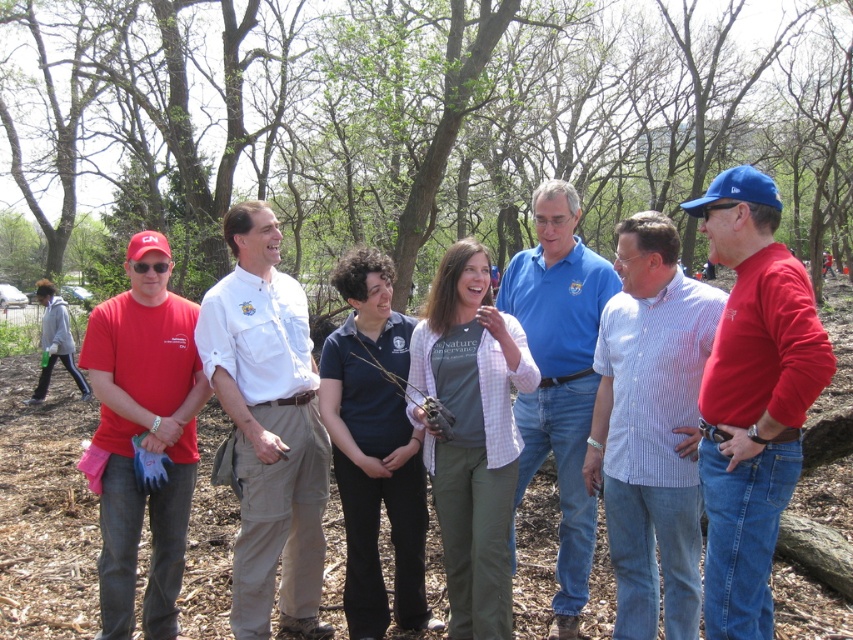
You are standing in the park and want to walk from point A to point B. Point A is at coordinate point (x=779, y=166) and point B is at coordinate point (x=482, y=417). Since you are facing the scene, which direction should you move to get from point A to point B?

To move from point A to point B, you should move downward and to the right because point B is located at a lower and more rightward position compared to point A.

You are a photographer trying to capture a group photo of the six men and one woman in the park. You want to ensure that both the green leafy tree at center and the dark blue shirt at center are visible in the frame. Which object should you position closer to the camera to ensure it takes up more space in the photo?

The green leafy tree at center is larger in size than the dark blue shirt at center, so positioning the green leafy tree at center closer to the camera would make it take up more space in the photo.